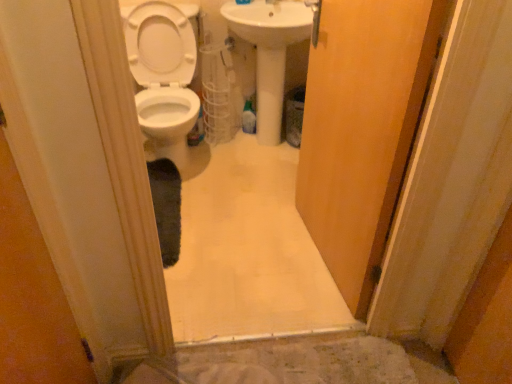
The width and height of the screenshot is (512, 384). What are the coordinates of `blank area beneath wooden door at center (from a real-world perspective)` in the screenshot? It's located at (314, 257).